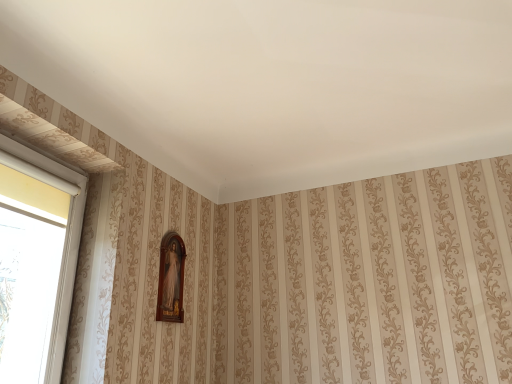
You are a GUI agent. You are given a task and a screenshot of the screen. Output one action in this format:
    pyautogui.click(x=<x>, y=<y>)
    Task: Click on the white plastic window at left
    The height and width of the screenshot is (384, 512).
    Given the screenshot: What is the action you would take?
    pyautogui.click(x=64, y=246)

Describe the element at coordinates (64, 246) in the screenshot. I see `white plastic window at left` at that location.

You are a GUI agent. You are given a task and a screenshot of the screen. Output one action in this format:
    pyautogui.click(x=<x>, y=<y>)
    Task: Click on the wooden frame at center
    The height and width of the screenshot is (384, 512).
    Given the screenshot: What is the action you would take?
    pyautogui.click(x=170, y=279)

What do you see at coordinates (170, 279) in the screenshot? I see `wooden frame at center` at bounding box center [170, 279].

Locate an element on the screen. The image size is (512, 384). white plastic window at left is located at coordinates (64, 246).

Can you confirm if white plastic window at left is positioned to the left of wooden frame at center?

Correct, you'll find white plastic window at left to the left of wooden frame at center.

Which is in front, white plastic window at left or wooden frame at center?

white plastic window at left is more forward.

Which is behind, point (60, 338) or point (177, 288)?

The point (177, 288) is more distant.

From the image's perspective, between white plastic window at left and wooden frame at center, which one is located above?

white plastic window at left.

From a real-world perspective, is white plastic window at left on wooden frame at center?

No, from a real-world perspective, white plastic window at left is not over wooden frame at center

Considering the sizes of white plastic window at left and wooden frame at center in the image, is white plastic window at left wider or thinner than wooden frame at center?

Clearly, white plastic window at left has more width compared to wooden frame at center.

Between white plastic window at left and wooden frame at center, which one has more height?

white plastic window at left.

Considering the sizes of white plastic window at left and wooden frame at center in the image, is white plastic window at left bigger or smaller than wooden frame at center?

In the image, white plastic window at left appears to be larger than wooden frame at center.

Which is correct: white plastic window at left is inside wooden frame at center, or outside of it?

white plastic window at left is located beyond the bounds of wooden frame at center.

Are white plastic window at left and wooden frame at center far apart?

That's not correct — white plastic window at left is a little close to wooden frame at center.

Is white plastic window at left turned away from wooden frame at center?

No.

From the picture: What's the angular difference between white plastic window at left and wooden frame at center's facing directions?

white plastic window at left and wooden frame at center are facing 0.812 degrees away from each other.

At what (x,y) coordinates should I click in order to perform the action: click on picture frame above the white plastic window at left (from a real-world perspective). Please return your answer as a coordinate pair (x, y). Image resolution: width=512 pixels, height=384 pixels. Looking at the image, I should click on (170, 279).

Between wooden frame at center and white plastic window at left, which one appears on the left side from the viewer's perspective?

Positioned to the left is white plastic window at left.

In the image, is wooden frame at center positioned in front of or behind white plastic window at left?

wooden frame at center is positioned farther from the viewer than white plastic window at left.

Is point (157, 318) positioned before point (63, 330)?

No, it is behind (63, 330).

In the scene shown: From the image's perspective, would you say wooden frame at center is positioned over white plastic window at left?

No, from the image's perspective, wooden frame at center is not over white plastic window at left.

Based on the photo, from a real-world perspective, is wooden frame at center positioned over white plastic window at left based on gravity?

Yes, from a real-world perspective, wooden frame at center is above white plastic window at left.

Which of these two, wooden frame at center or white plastic window at left, is wider?

Wider between the two is white plastic window at left.

Which of these two, wooden frame at center or white plastic window at left, stands taller?

Standing taller between the two is white plastic window at left.

Can you confirm if wooden frame at center is smaller than white plastic window at left?

Correct, wooden frame at center occupies less space than white plastic window at left.

In the scene shown: Is white plastic window at left surrounded by wooden frame at center?

No, white plastic window at left is not a part of wooden frame at center.

Is wooden frame at center far from white plastic window at left?

No.

Is wooden frame at center aimed at white plastic window at left?

No, wooden frame at center is not oriented towards white plastic window at left.

From the picture: How different are the orientations of wooden frame at center and white plastic window at left in degrees?

The angle between the facing direction of wooden frame at center and the facing direction of white plastic window at left is 0.812 degrees.

How far apart are wooden frame at center and white plastic window at left?

wooden frame at center and white plastic window at left are 57.22 centimeters apart from each other.

Where is `picture frame located above the white plastic window at left (from a real-world perspective)`? picture frame located above the white plastic window at left (from a real-world perspective) is located at coordinates (170, 279).

Locate an element on the screen. picture frame above the white plastic window at left (from a real-world perspective) is located at coordinates pos(170,279).

In order to click on picture frame lying below the white plastic window at left (from the image's perspective) in this screenshot , I will do `click(170, 279)`.